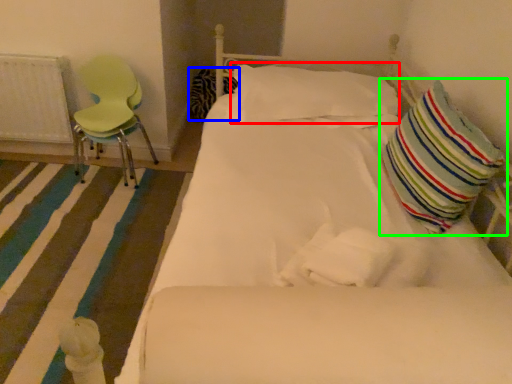
Question: Estimate the real-world distances between objects in this image. Which object is farther from pillow (highlighted by a red box), pillow (highlighted by a blue box) or pillow (highlighted by a green box)?

Choices:
 (A) pillow
 (B) pillow

Answer: (A)